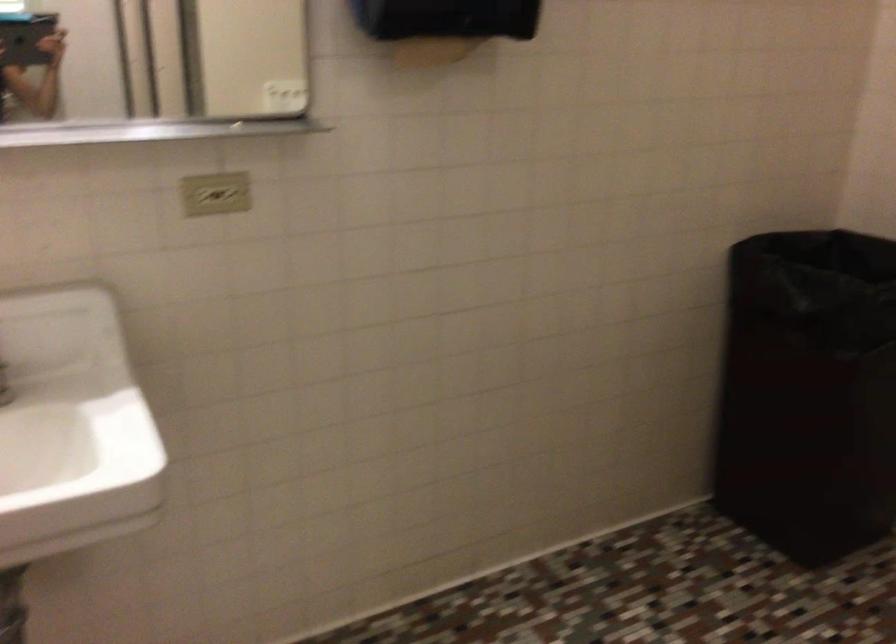
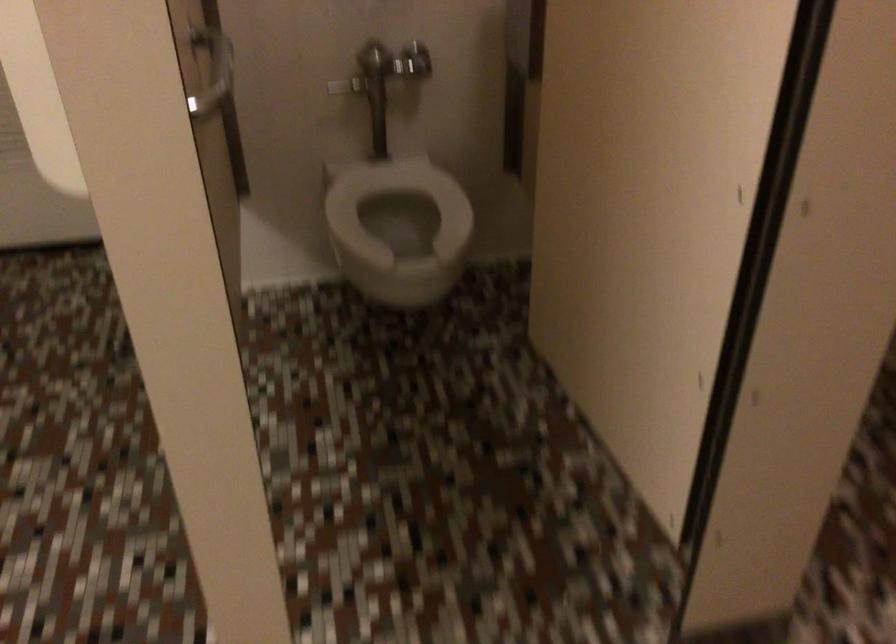
The first image is from the beginning of the video and the second image is from the end. How did the camera likely rotate when shooting the video?

The camera rotated toward right-down.